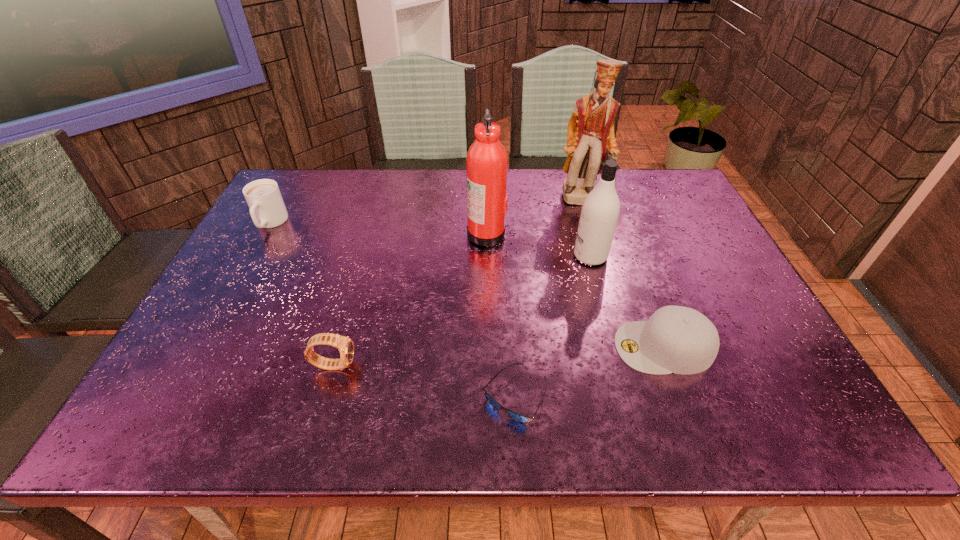
You are a GUI agent. You are given a task and a screenshot of the screen. Output one action in this format:
    pyautogui.click(x=<x>, y=<y>)
    Task: Click on the nutcracker
    The height and width of the screenshot is (540, 960).
    Given the screenshot: What is the action you would take?
    pyautogui.click(x=590, y=133)

Find the location of a particular element. fire extinguisher is located at coordinates (487, 162).

Identify the location of shampoo. (600, 210).

Locate an element on the screen. Image resolution: width=960 pixels, height=540 pixels. cappuccino is located at coordinates (267, 209).

Locate an element on the screen. the fourth shortest object is located at coordinates (267, 209).

The width and height of the screenshot is (960, 540). I want to click on the sixth object from right to left, so click(x=345, y=345).

This screenshot has height=540, width=960. I want to click on cap, so click(676, 339).

This screenshot has height=540, width=960. What are the coordinates of `sunglasses` in the screenshot? It's located at (518, 417).

Find the location of a particular element. This screenshot has width=960, height=540. vacant position located 0.100m on the front-facing side of the nutcracker is located at coordinates click(595, 230).

Identify the location of free location located 0.260m on the label side of the fire extinguisher. The height and width of the screenshot is (540, 960). (376, 233).